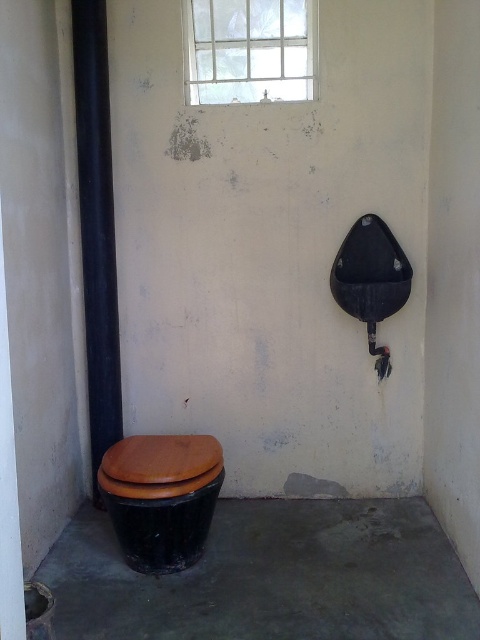
You are a maintenance worker inspecting the restroom. You notice the clear glass window at upper center and the brown matte toilet lid at lower left. Which object has a smaller size?

The clear glass window at upper center has a smaller size compared to the brown matte toilet lid at lower left.

You are a maintenance worker inspecting the restroom. You notice the black matte cement at lower left and the clear glass window at upper center. Which object is closer to you from your current position in the restroom?

The black matte cement at lower left is closer to you because it is in front of the clear glass window at upper center.